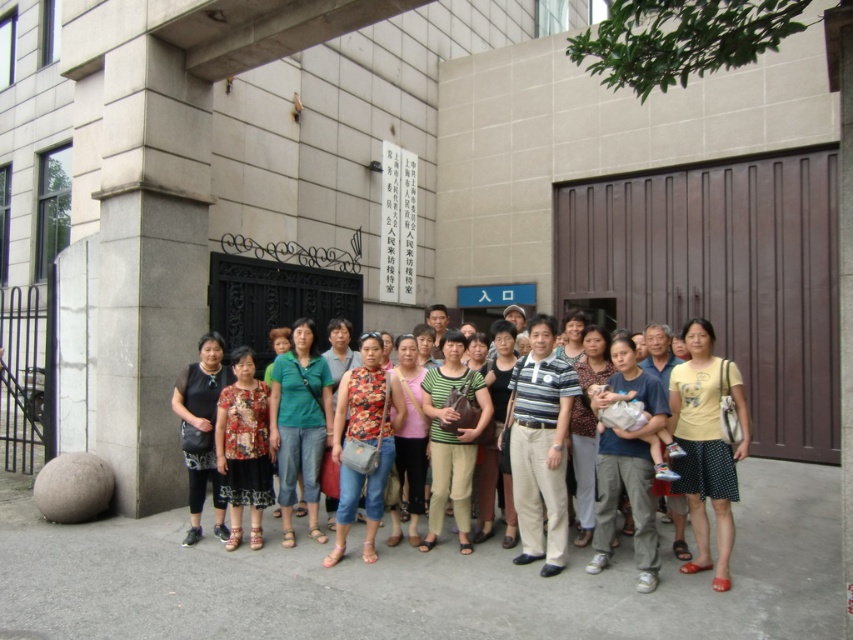
Question: Is printed fabric tank top at center to the right of matte green tank top at center from the viewer's perspective?

Choices:
 (A) no
 (B) yes

Answer: (A)

Question: Observing the image, what is the correct spatial positioning of yellow cotton shirt at center in reference to green matte shirt at center?

Choices:
 (A) right
 (B) left

Answer: (A)

Question: Which point is farther to the camera?

Choices:
 (A) (210, 372)
 (B) (292, 387)

Answer: (A)

Question: Is yellow cotton shirt at center further to the viewer compared to printed fabric tank top at center?

Choices:
 (A) no
 (B) yes

Answer: (A)

Question: Which object appears farthest from the camera in this image?

Choices:
 (A) floral fabric dress at center
 (B) yellow cotton shirt at center
 (C) matte green tank top at center
 (D) green striped shirt at center

Answer: (D)

Question: Which point is closer to the camera taking this photo?

Choices:
 (A) (488, 525)
 (B) (419, 509)

Answer: (B)